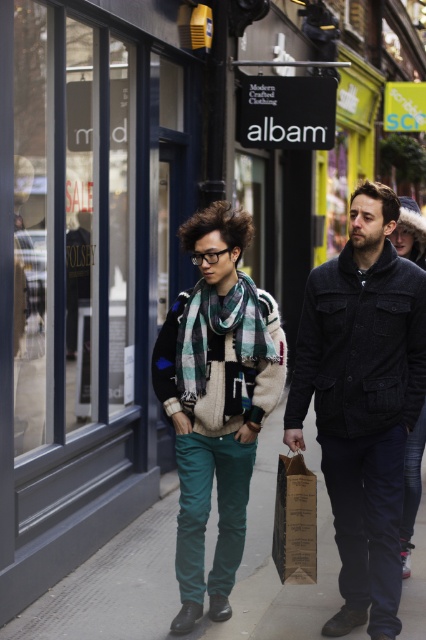
You are a fashion designer observing the two individuals in the street scene. You need to determine which item is positioned lower on the person wearing the dark woolen jacket at center and the green plaid scarf at center. Which item is lower?

The dark woolen jacket at center is located below the green plaid scarf at center, so the dark woolen jacket at center is positioned lower.

You are a delivery drone operator. Your drone needs to drop off a package to the teal fabric pants at lower center. The drone can only release the package within a 35 inch radius. Is the brown paper bag at center within the drop zone?

The teal fabric pants at lower center is 37.22 inches away from brown paper bag at center. Since the distance is greater than the 35 inch radius, the package will land outside the drop zone, so the brown paper bag at center is not within the drop zone.

Based on the photo, you are a delivery person who needs to hand over a package to the person wearing the dark woolen jacket at center. However, you can only reach items that are smaller than the brown paper bag at center. Can you hand over the package to them?

The dark woolen jacket at center is larger in size than the brown paper bag at center. Since the package must be smaller than the brown paper bag at center to be handed over, and the dark woolen jacket at center is bigger, you cannot hand over the package to them.